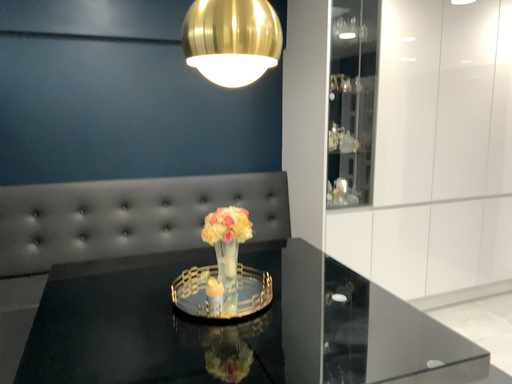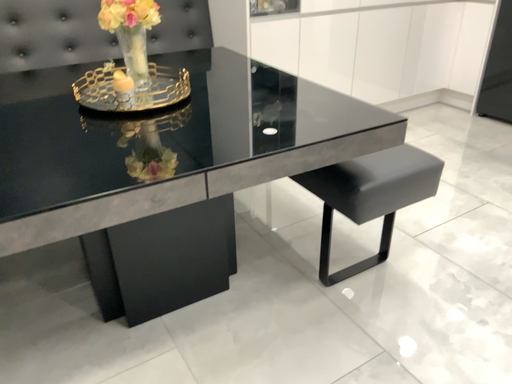
Question: Which way did the camera rotate in the video?

Choices:
 (A) rotated upward
 (B) rotated downward

Answer: (B)